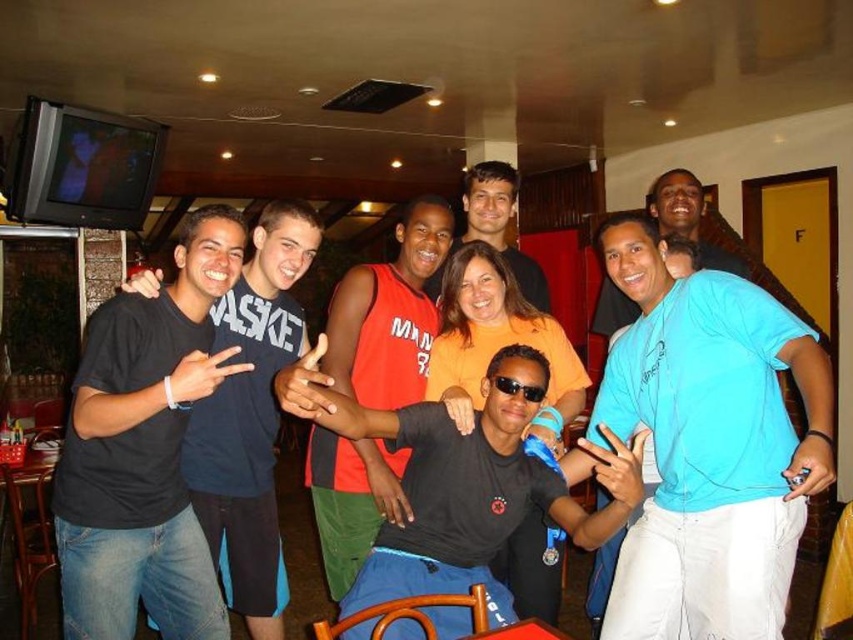
Is point (659, 605) closer to viewer compared to point (534, 403)?

Yes, it is in front of point (534, 403).

Between point (759, 486) and point (525, 394), which one is positioned behind?

Positioned behind is point (525, 394).

Is point (747, 474) positioned behind point (538, 388)?

No, (747, 474) is in front of (538, 388).

The height and width of the screenshot is (640, 853). What are the coordinates of `blue cotton t-shirt at center` in the screenshot? It's located at (709, 445).

Is black matte t-shirt at center bigger than black plastic sunglasses at center?

Yes, black matte t-shirt at center is bigger than black plastic sunglasses at center.

Can you confirm if black matte t-shirt at center is smaller than black plastic sunglasses at center?

No.

At what (x,y) coordinates should I click in order to perform the action: click on black matte t-shirt at center. Please return your answer as a coordinate pair (x, y). Looking at the image, I should click on (462, 483).

What do you see at coordinates (709, 445) in the screenshot?
I see `blue cotton t-shirt at center` at bounding box center [709, 445].

Can you confirm if blue cotton t-shirt at center is positioned to the right of black matte t-shirt at center?

Yes, blue cotton t-shirt at center is to the right of black matte t-shirt at center.

The height and width of the screenshot is (640, 853). Describe the element at coordinates (709, 445) in the screenshot. I see `blue cotton t-shirt at center` at that location.

The width and height of the screenshot is (853, 640). In order to click on blue cotton t-shirt at center in this screenshot , I will do point(709,445).